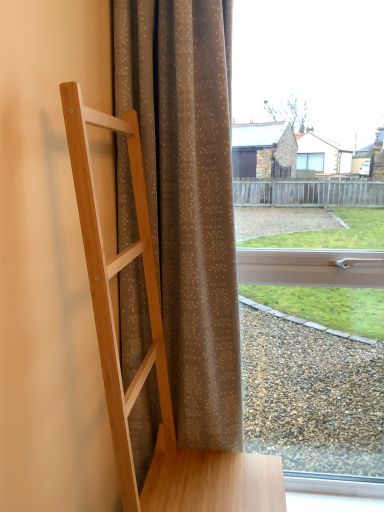
Question: From a real-world perspective, is brown sheer curtain at center physically above natural wood ladder at left?

Choices:
 (A) yes
 (B) no

Answer: (A)

Question: Does brown sheer curtain at center have a lesser width compared to natural wood ladder at left?

Choices:
 (A) no
 (B) yes

Answer: (B)

Question: Is natural wood ladder at left inside brown sheer curtain at center?

Choices:
 (A) yes
 (B) no

Answer: (B)

Question: Is brown sheer curtain at center in front of natural wood ladder at left?

Choices:
 (A) yes
 (B) no

Answer: (B)

Question: Is brown sheer curtain at center placed right next to natural wood ladder at left?

Choices:
 (A) no
 (B) yes

Answer: (A)

Question: Does brown sheer curtain at center have a larger size compared to natural wood ladder at left?

Choices:
 (A) no
 (B) yes

Answer: (A)

Question: Considering the relative positions of natural wood ladder at left and brown sheer curtain at center in the image provided, is natural wood ladder at left behind brown sheer curtain at center?

Choices:
 (A) yes
 (B) no

Answer: (B)

Question: Is natural wood ladder at left outside of brown sheer curtain at center?

Choices:
 (A) yes
 (B) no

Answer: (A)

Question: From a real-world perspective, does natural wood ladder at left sit lower than brown sheer curtain at center?

Choices:
 (A) no
 (B) yes

Answer: (B)

Question: From a real-world perspective, is natural wood ladder at left positioned over brown sheer curtain at center based on gravity?

Choices:
 (A) yes
 (B) no

Answer: (B)

Question: Is natural wood ladder at left wider than brown sheer curtain at center?

Choices:
 (A) no
 (B) yes

Answer: (B)

Question: Is natural wood ladder at left thinner than brown sheer curtain at center?

Choices:
 (A) yes
 (B) no

Answer: (B)

Question: From the image's perspective, is brown sheer curtain at center below transparent glass window at center?

Choices:
 (A) no
 (B) yes

Answer: (B)